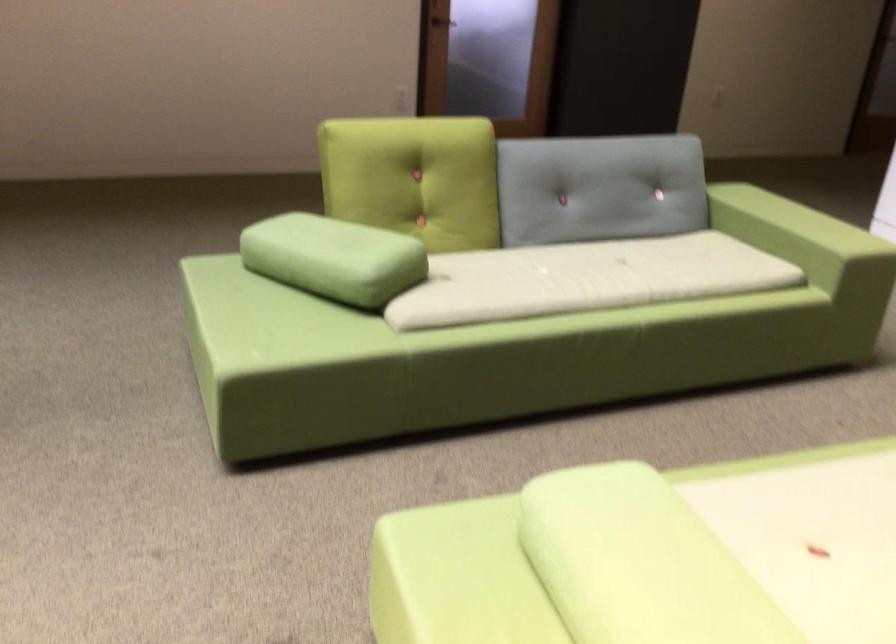
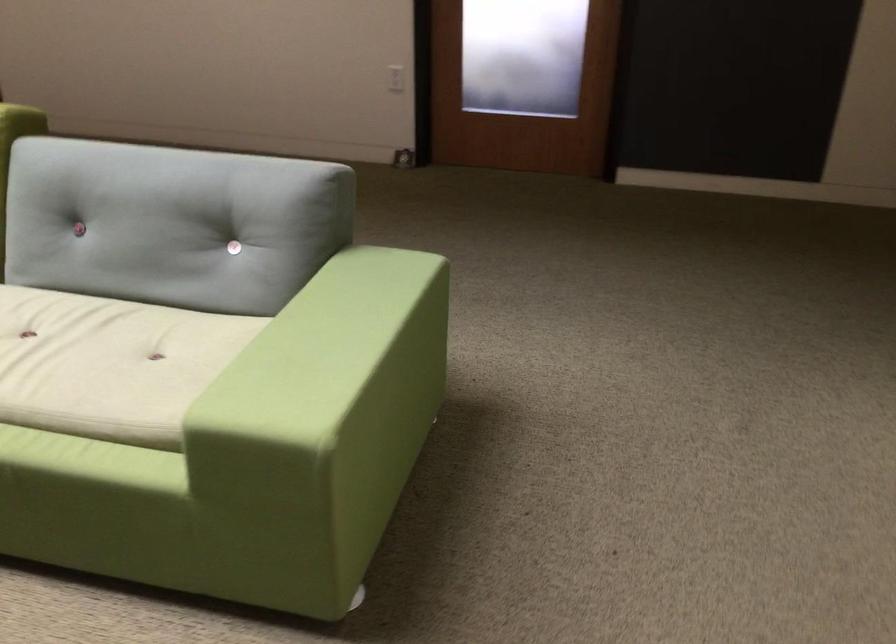
In the second image, find the point that corresponds to point (698, 259) in the first image.

(109, 364)